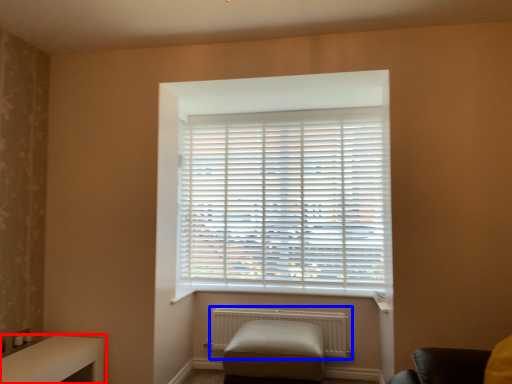
Question: Which object is closer to the camera taking this photo, table (highlighted by a red box) or radiator (highlighted by a blue box)?

Choices:
 (A) table
 (B) radiator

Answer: (A)